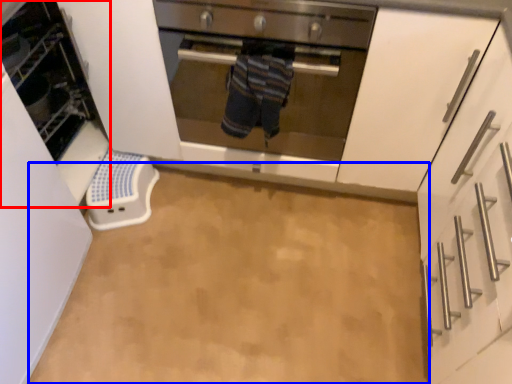
Question: Among these objects, which one is farthest to the camera, appliance (highlighted by a red box) or plain (highlighted by a blue box)?

Choices:
 (A) appliance
 (B) plain

Answer: (B)